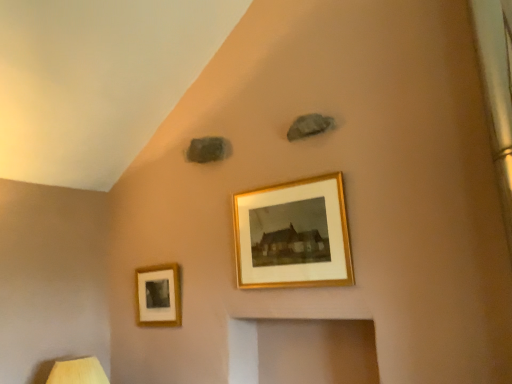
Question: Is matte gold picture frame at lower left, the first picture frame viewed from the left, inside or outside of gold-framed picture at center, the 2th picture frame viewed from the left?

Choices:
 (A) outside
 (B) inside

Answer: (A)

Question: In terms of size, does matte gold picture frame at lower left, positioned as the second picture frame in right-to-left order, appear bigger or smaller than gold-framed picture at center, the 2th picture frame positioned from the back?

Choices:
 (A) small
 (B) big

Answer: (A)

Question: Based on their relative distances, which object is farther from the wooden table lamp at lower left?

Choices:
 (A) matte gold picture frame at lower left, the 2th picture frame when ordered from front to back
 (B) gold-framed picture at center, the 1th picture frame when ordered from top to bottom

Answer: (B)

Question: Estimate the real-world distances between objects in this image. Which object is farther from the wooden table lamp at lower left?

Choices:
 (A) gold-framed picture at center, the 2th picture frame positioned from the back
 (B) matte gold picture frame at lower left, the second picture frame from the top

Answer: (A)